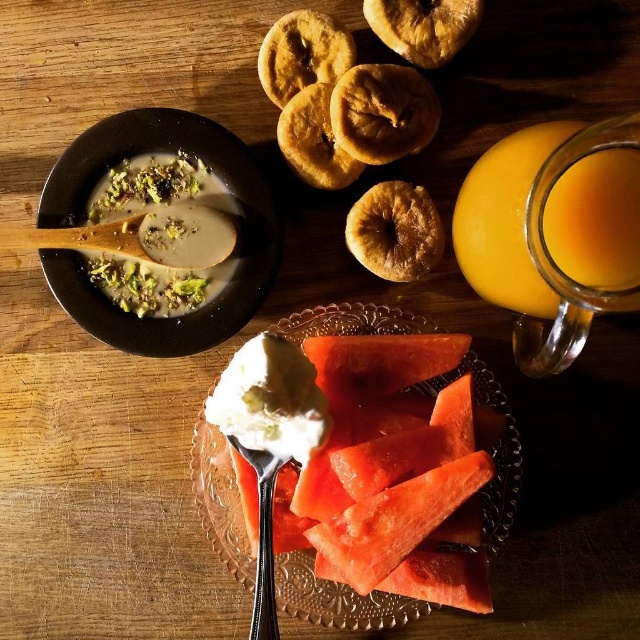
Does pink juicy watermelon slices at center have a smaller size compared to translucent glass jar of orange juice at upper right?

No, pink juicy watermelon slices at center is not smaller than translucent glass jar of orange juice at upper right.

Does point (340, 348) come farther from viewer compared to point (506, 241)?

Yes, point (340, 348) is behind point (506, 241).

Between point (344, 500) and point (612, 224), which one is positioned in front?

Point (612, 224) is more forward.

In order to click on pink juicy watermelon slices at center in this screenshot , I will do pyautogui.click(x=360, y=456).

Can you confirm if translucent glass jar of orange juice at upper right is positioned above white creamy soup at upper left?

No, translucent glass jar of orange juice at upper right is not above white creamy soup at upper left.

Between translucent glass jar of orange juice at upper right and white creamy soup at upper left, which one has more height?

translucent glass jar of orange juice at upper right

Between point (532, 276) and point (141, 182), which one is positioned in front?

Point (532, 276)

Identify the location of translucent glass jar of orange juice at upper right. Image resolution: width=640 pixels, height=640 pixels. (506, 220).

Which is more to the right, pink juicy watermelon slices at center or white creamy soup at upper left?

pink juicy watermelon slices at center

Can you confirm if pink juicy watermelon slices at center is wider than white creamy soup at upper left?

Yes, pink juicy watermelon slices at center is wider than white creamy soup at upper left.

At what (x,y) coordinates should I click in order to perform the action: click on pink juicy watermelon slices at center. Please return your answer as a coordinate pair (x, y). This screenshot has height=640, width=640. Looking at the image, I should click on (360, 456).